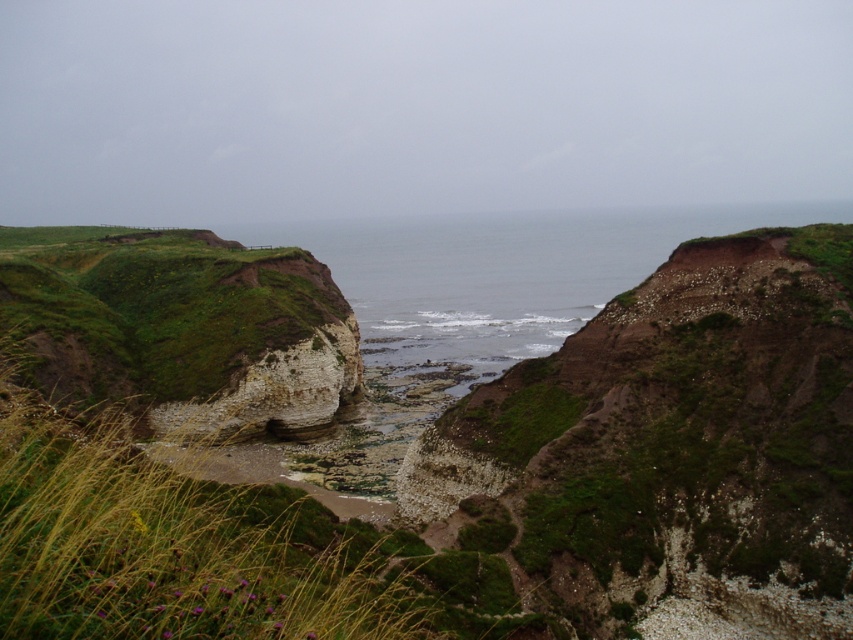
Can you confirm if green mossy rock at left is bigger than white limestone cliff at center?

Indeed, green mossy rock at left has a larger size compared to white limestone cliff at center.

Consider the image. Between green mossy rock at left and white limestone cliff at center, which one has more height?

green mossy rock at left

Measure the distance between green mossy rock at left and camera.

green mossy rock at left and camera are 327.24 feet apart from each other.

You are a GUI agent. You are given a task and a screenshot of the screen. Output one action in this format:
    pyautogui.click(x=<x>, y=<y>)
    Task: Click on the green mossy rock at left
    Image resolution: width=853 pixels, height=640 pixels.
    Given the screenshot: What is the action you would take?
    pyautogui.click(x=178, y=328)

Does green mossy hillside at center appear on the right side of green mossy rock at left?

Yes, green mossy hillside at center is to the right of green mossy rock at left.

Can you confirm if green mossy hillside at center is positioned above green mossy rock at left?

Actually, green mossy hillside at center is below green mossy rock at left.

What do you see at coordinates (669, 449) in the screenshot? I see `green mossy hillside at center` at bounding box center [669, 449].

The image size is (853, 640). Find the location of `green mossy hillside at center`. green mossy hillside at center is located at coordinates point(669,449).

Between green mossy hillside at center and white limestone cliff at center, which one appears on the left side from the viewer's perspective?

Positioned to the left is white limestone cliff at center.

This screenshot has height=640, width=853. I want to click on green mossy hillside at center, so click(x=669, y=449).

At what (x,y) coordinates should I click in order to perform the action: click on green mossy hillside at center. Please return your answer as a coordinate pair (x, y). The image size is (853, 640). Looking at the image, I should click on (669, 449).